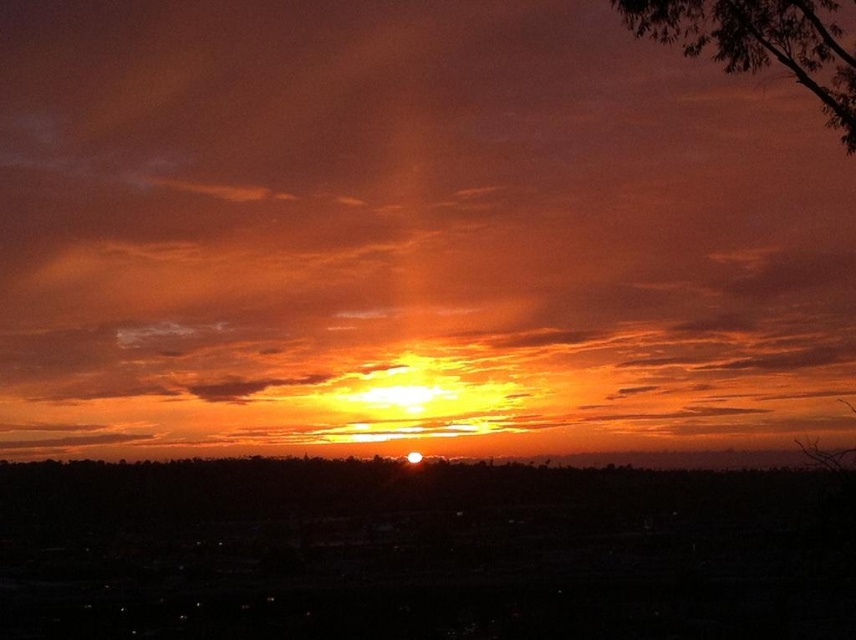
Is orange matte cloud at center in front of dark green leafy tree at upper right?

No, it is behind dark green leafy tree at upper right.

Can you confirm if orange matte cloud at center is positioned to the left of dark green leafy tree at upper right?

Yes, orange matte cloud at center is to the left of dark green leafy tree at upper right.

At what (x,y) coordinates should I click in order to perform the action: click on orange matte cloud at center. Please return your answer as a coordinate pair (x, y). This screenshot has height=640, width=856. Looking at the image, I should click on (407, 234).